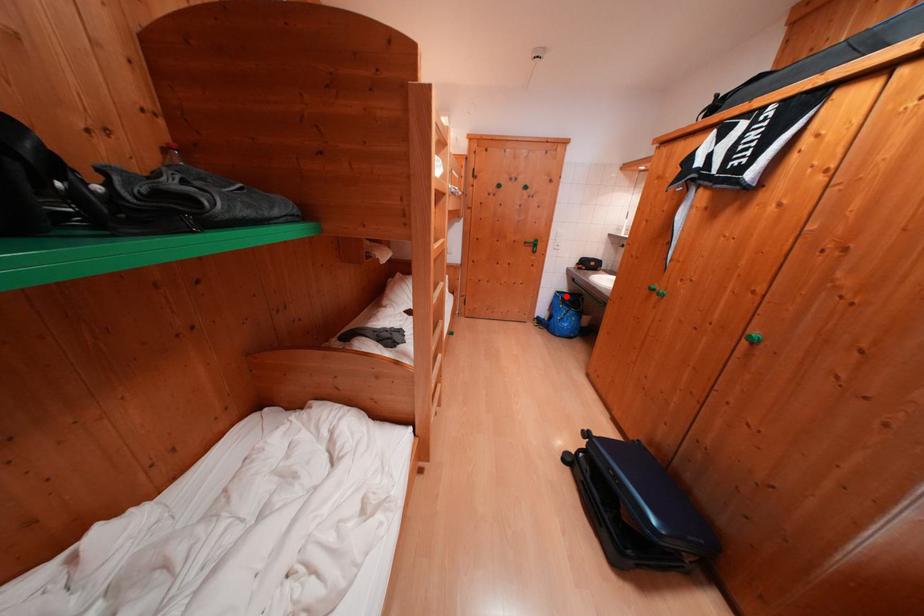
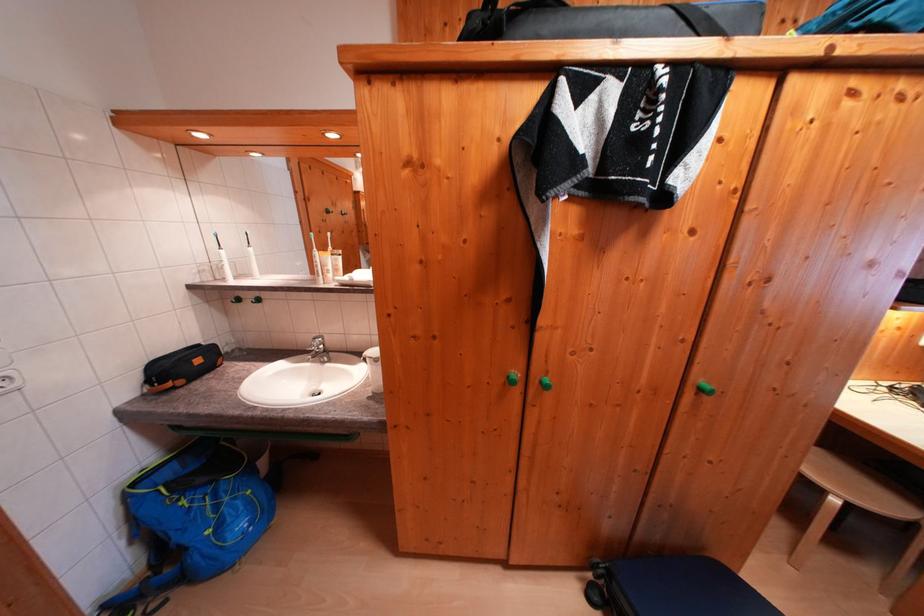
Where in the second image is the point corresponding to the highlighted location from the first image?

(142, 488)